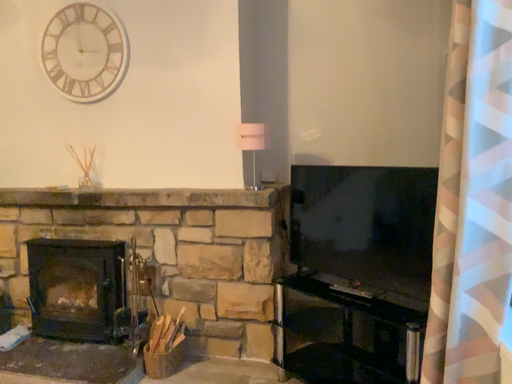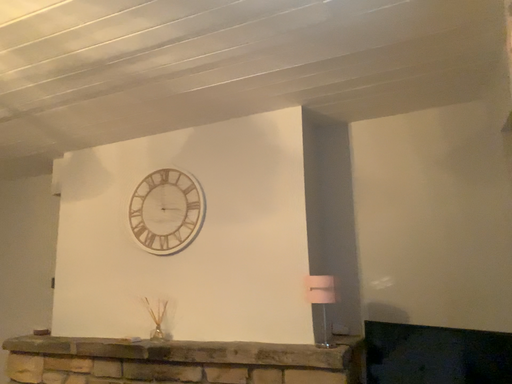
Question: How did the camera likely rotate when shooting the video?

Choices:
 (A) rotated right
 (B) rotated left

Answer: (B)